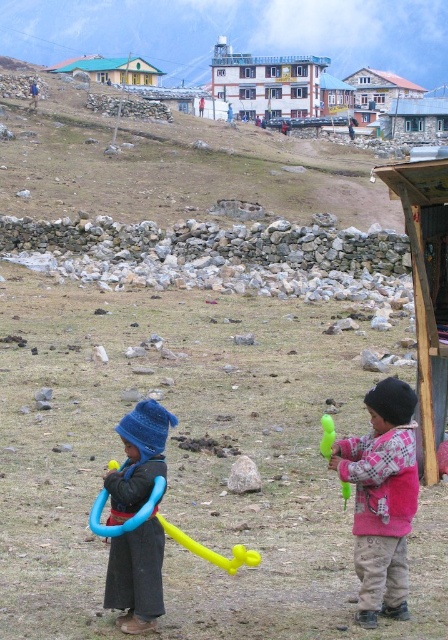
Question: Which point is closer to the camera?

Choices:
 (A) pink fleece jacket at center
 (B) green corrugated metal hut at upper left
 (C) green rubber toy at right

Answer: (A)

Question: Can you confirm if pink fleece jacket at center is wider than white painted wood at upper center?

Choices:
 (A) no
 (B) yes

Answer: (A)

Question: Does pink fleece jacket at center have a smaller size compared to blue knitted hat at left?

Choices:
 (A) no
 (B) yes

Answer: (A)

Question: Which object appears farthest from the camera in this image?

Choices:
 (A) wooden cabin at upper center
 (B) white painted wood at upper center

Answer: (A)

Question: Is wooden cabin at upper center smaller than green rubber toy at right?

Choices:
 (A) no
 (B) yes

Answer: (A)

Question: Which object appears closest to the camera in this image?

Choices:
 (A) green rubber toy at right
 (B) pink fleece jacket at center
 (C) blue knitted hat at left
 (D) white painted wood at upper center

Answer: (C)